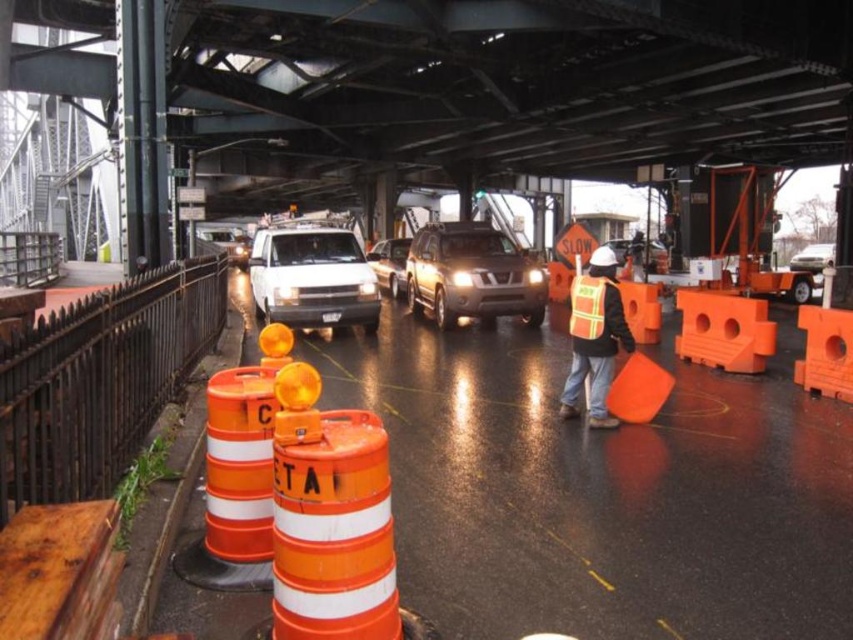
Does orange reflective barrel at left appear over white matte van at center?

No, orange reflective barrel at left is not above white matte van at center.

Who is more forward, (225, 300) or (337, 252)?

Positioned in front is point (225, 300).

Which is behind, point (24, 490) or point (358, 300)?

The point (358, 300) is more distant.

Identify the location of orange reflective barrel at left. (100, 380).

Can you confirm if white matte van at center is wider than hi-visibility reflective vest at center?

Correct, the width of white matte van at center exceeds that of hi-visibility reflective vest at center.

The height and width of the screenshot is (640, 853). Describe the element at coordinates (312, 278) in the screenshot. I see `white matte van at center` at that location.

Locate an element on the screen. The width and height of the screenshot is (853, 640). white matte van at center is located at coordinates (312, 278).

Between satin gold suv at center and white glossy sedan at center, which one is positioned higher?

white glossy sedan at center is above.

Which is more to the right, satin gold suv at center or white glossy sedan at center?

Positioned to the right is white glossy sedan at center.

Is point (492, 285) more distant than point (810, 250)?

No, (492, 285) is in front of (810, 250).

At what (x,y) coordinates should I click in order to perform the action: click on satin gold suv at center. Please return your answer as a coordinate pair (x, y). Image resolution: width=853 pixels, height=640 pixels. Looking at the image, I should click on (473, 275).